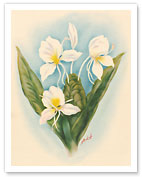
This screenshot has height=177, width=142. I want to click on yelllow flower interior, so click(x=54, y=56), click(x=97, y=58), click(x=58, y=98).